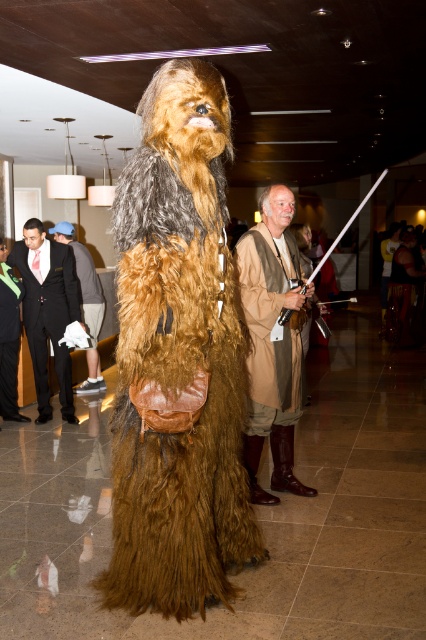
Question: Estimate the real-world distances between objects in this image. Which object is farther from the black suit at left?

Choices:
 (A) brown leather boots at lower center
 (B) green satin tie at lower left

Answer: (A)

Question: Among these points, which one is farthest from the camera?

Choices:
 (A) (267, 282)
 (B) (158, 282)
 (C) (103, 308)
 (D) (42, 348)

Answer: (C)

Question: Can you confirm if brown leather boots at lower center is smaller than green satin tie at lower left?

Choices:
 (A) yes
 (B) no

Answer: (B)

Question: Does brown furry costume at center have a lesser width compared to black suit at left?

Choices:
 (A) no
 (B) yes

Answer: (A)

Question: Does black suit at left have a smaller size compared to green satin tie at lower left?

Choices:
 (A) yes
 (B) no

Answer: (B)

Question: Which point appears closest to the camera in this image?

Choices:
 (A) (11, 419)
 (B) (83, 250)

Answer: (A)